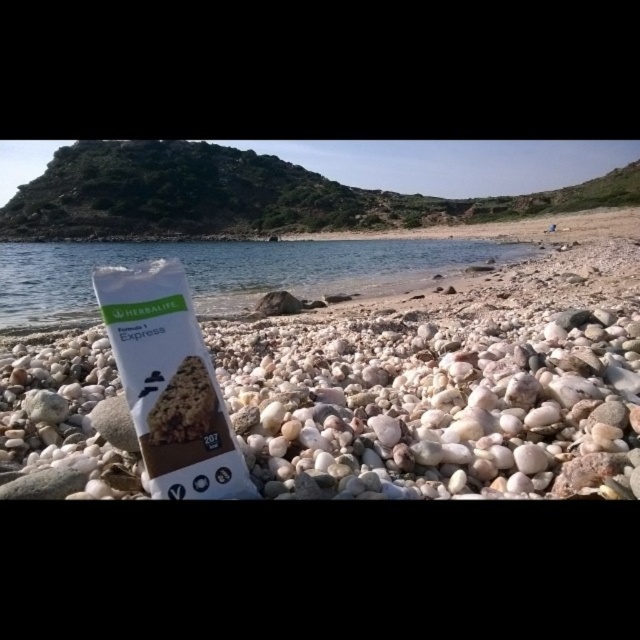
Which is below, white pebbled beach at center or white cardboard package at center?

white cardboard package at center is lower down.

Between point (593, 442) and point (182, 497), which one is positioned behind?

The point (593, 442) is more distant.

This screenshot has width=640, height=640. Describe the element at coordinates (451, 380) in the screenshot. I see `white pebbled beach at center` at that location.

Where is `white pebbled beach at center`? This screenshot has height=640, width=640. white pebbled beach at center is located at coordinates (451, 380).

Who is taller, white pebbled beach at center or clear water at center?

Standing taller between the two is clear water at center.

Does white pebbled beach at center come in front of clear water at center?

Yes, it is in front of clear water at center.

Image resolution: width=640 pixels, height=640 pixels. What are the coordinates of `white pebbled beach at center` in the screenshot? It's located at (451, 380).

The height and width of the screenshot is (640, 640). Identify the location of white pebbled beach at center. (451, 380).

Can you confirm if clear water at center is positioned to the right of white cardboard package at center?

Incorrect, clear water at center is not on the right side of white cardboard package at center.

Can you confirm if clear water at center is positioned to the left of white cardboard package at center?

Correct, you'll find clear water at center to the left of white cardboard package at center.

Is point (4, 275) behind point (141, 273)?

Yes, point (4, 275) is farther from viewer.

Find the location of a particular element. Image resolution: width=640 pixels, height=640 pixels. clear water at center is located at coordinates (228, 272).